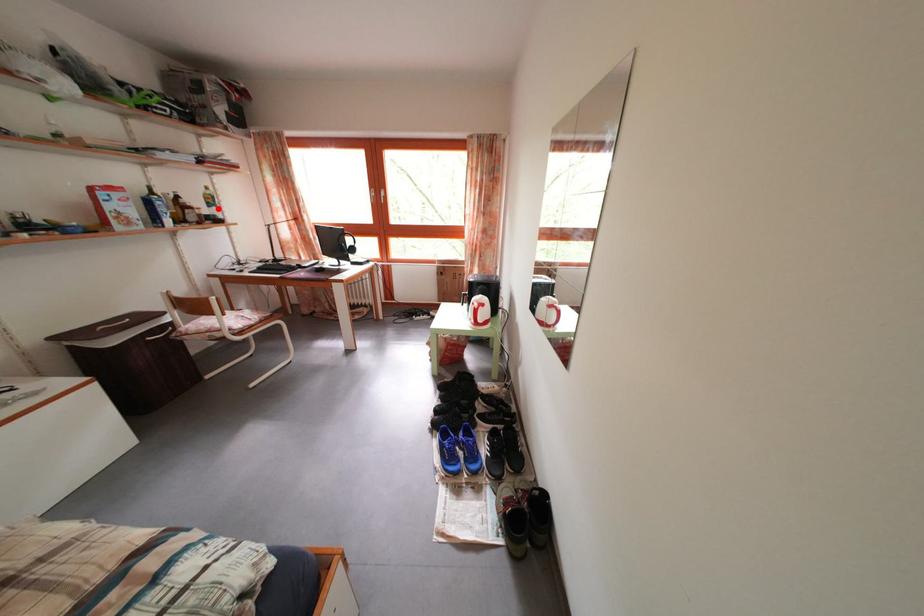
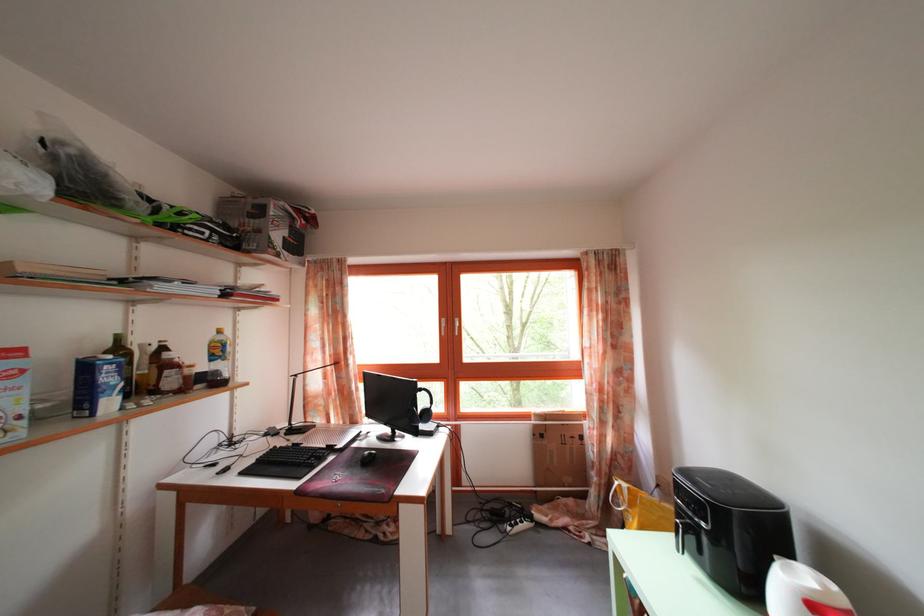
Where in the second image is the point corresponding to the highlighted location from the first image?

(225, 359)